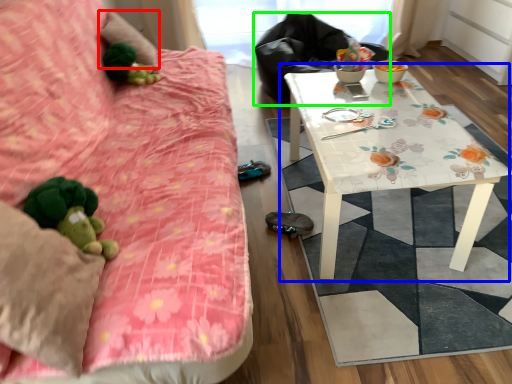
Question: Which object is positioned closest to pillow (highlighted by a red box)? Select from table (highlighted by a blue box) and sit (highlighted by a green box).

Choices:
 (A) table
 (B) sit

Answer: (B)